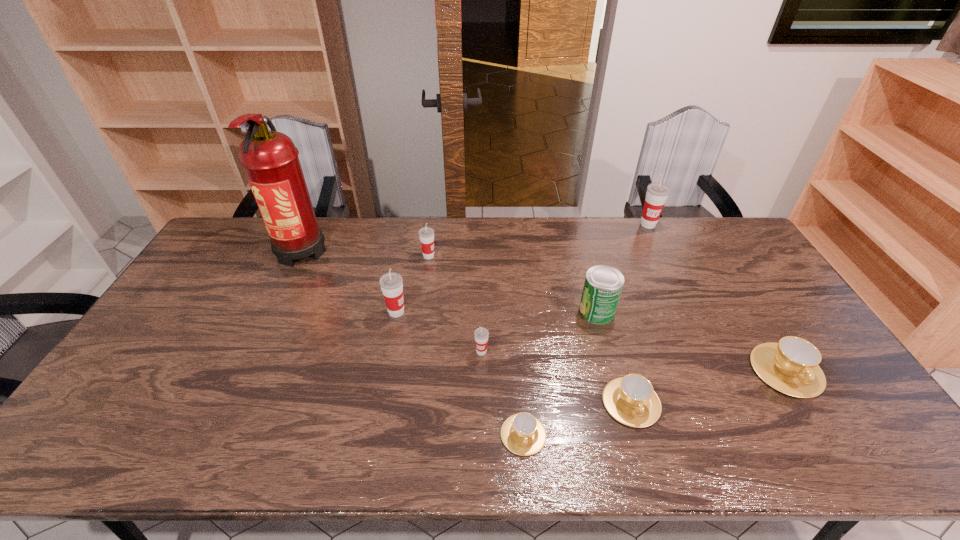
At what (x,y) coordinates should I click in order to perform the action: click on fire extinguisher. Please return your answer as a coordinate pair (x, y). The image size is (960, 540). Looking at the image, I should click on (270, 159).

Image resolution: width=960 pixels, height=540 pixels. Identify the location of the tallest object. (270, 159).

At what (x,y) coordinates should I click in order to perform the action: click on the eighth object from left to right. Please return your answer as a coordinate pair (x, y). Looking at the image, I should click on (657, 193).

The height and width of the screenshot is (540, 960). Identify the location of the second tallest object. (657, 193).

Where is `the leftmost red cup`? the leftmost red cup is located at coordinates (391, 284).

Locate an element on the screen. The height and width of the screenshot is (540, 960). the third farthest red cup is located at coordinates (391, 284).

Where is `the second farthest cup`? The height and width of the screenshot is (540, 960). the second farthest cup is located at coordinates (426, 234).

At what (x,y) coordinates should I click in order to perform the action: click on the third object from left to right. Please return your answer as a coordinate pair (x, y). This screenshot has height=540, width=960. Looking at the image, I should click on (426, 234).

This screenshot has height=540, width=960. Find the location of `green can`. green can is located at coordinates (603, 284).

Find the location of a particular element. This screenshot has width=960, height=540. the second red cup from right to left is located at coordinates (481, 334).